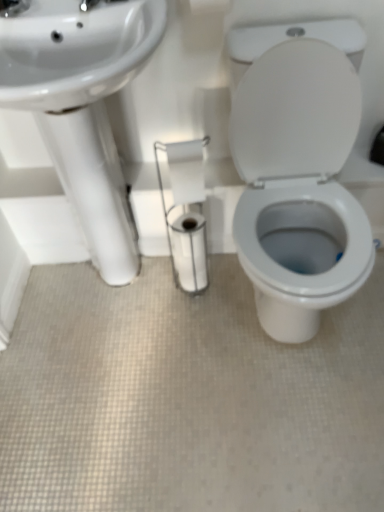
Question: In terms of width, does white glossy toilet paper at center, the 1th toilet paper positioned from the bottom, look wider or thinner when compared to white glossy sink at left?

Choices:
 (A) wide
 (B) thin

Answer: (B)

Question: Considering the positions of white glossy toilet paper at center, the 1th toilet paper positioned from the bottom, and white glossy sink at left in the image, is white glossy toilet paper at center, the 1th toilet paper positioned from the bottom, taller or shorter than white glossy sink at left?

Choices:
 (A) short
 (B) tall

Answer: (A)

Question: Which of these objects is positioned closest to the white glossy porcelain at center?

Choices:
 (A) white glossy sink at left
 (B) white glossy toilet paper at center, the 1th toilet paper positioned from the bottom
 (C) white matte toilet paper at upper center, which appears as the second toilet paper when ordered from the bottom

Answer: (B)

Question: Which object is the farthest from the white glossy sink at left?

Choices:
 (A) white glossy porcelain at center
 (B) white glossy toilet paper at center, the 1th toilet paper positioned from the bottom
 (C) white matte toilet paper at upper center, which appears as the second toilet paper when ordered from the bottom

Answer: (C)